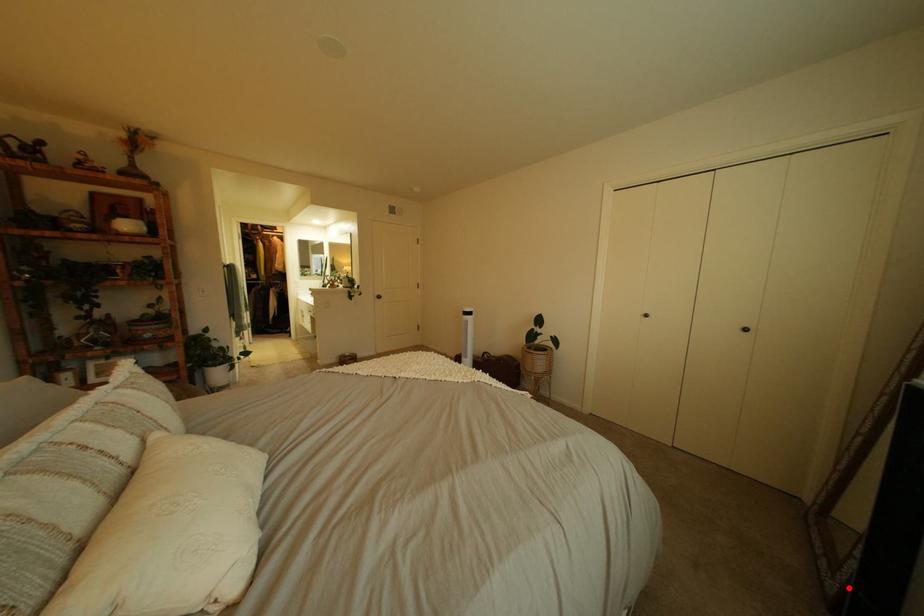
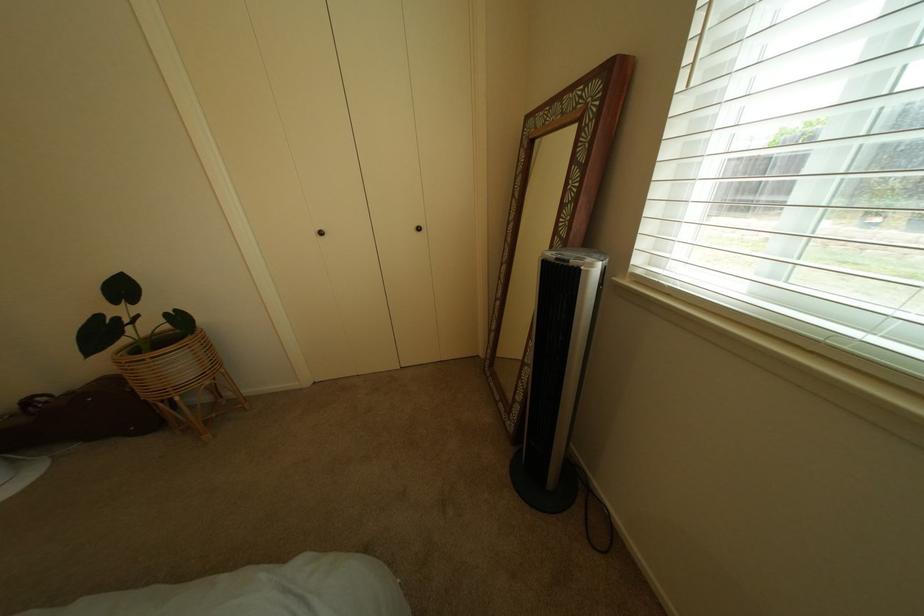
In the second image, find the point that corresponds to the highlighted location in the first image.

(527, 428)